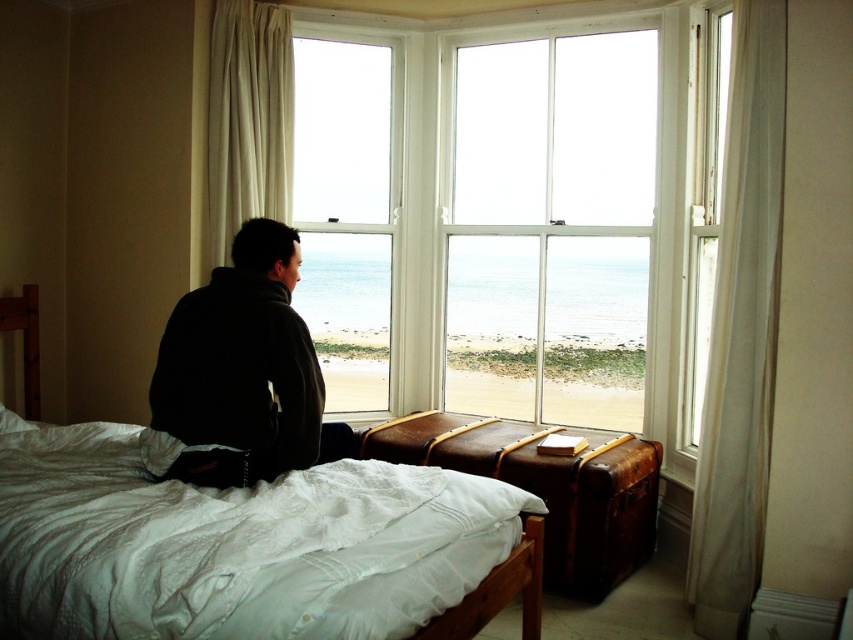
Question: Which object is positioned closest to the dark matte jacket at center?

Choices:
 (A) white sheer curtain at right
 (B) white cotton bed at center
 (C) clear water at window center

Answer: (B)

Question: Does white sheer curtain at right have a greater width compared to dark matte jacket at center?

Choices:
 (A) no
 (B) yes

Answer: (A)

Question: Which point is farther to the camera?

Choices:
 (A) (440, 508)
 (B) (263, 317)

Answer: (B)

Question: Does white cotton bed at center appear over white sheer curtain at left?

Choices:
 (A) yes
 (B) no

Answer: (B)

Question: Does clear water at window center have a lesser width compared to white sheer curtain at left?

Choices:
 (A) yes
 (B) no

Answer: (B)

Question: Which of the following is the closest to the observer?

Choices:
 (A) white sheer curtain at right
 (B) dark matte jacket at center

Answer: (B)